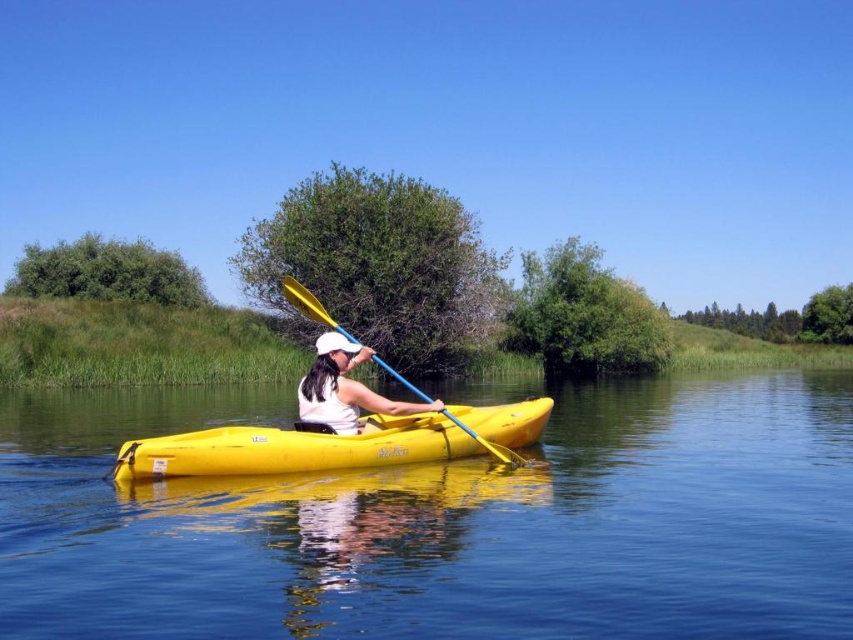
You are a photographer capturing the kayaker from above. You need to ensure both the yellow matte kayak at center and the yellow plastic paddle at center are clearly visible in your shot. Based on their positions, which object should you focus on first to capture both in the frame?

The yellow matte kayak at center is located below the yellow plastic paddle at center, so you should focus on the yellow plastic paddle at center first to ensure both are in the frame.

You are a safety inspector checking the distance between the yellow matte kayak at center and the white matte visor at center. The safety regulation requires at least 2 meters between them. Is the current distance compliant?

The yellow matte kayak at center and the white matte visor at center are 2.18 meters apart, which exceeds the required 2 meters, so the current distance is compliant.

You are a drone operator trying to capture a photo of the yellow matte kayak at center and the yellow plastic paddle at center. The camera has a maximum focus range of 7 meters. Can you capture both objects in focus without moving the drone?

The yellow matte kayak at center and yellow plastic paddle at center are 7.15 meters apart from each other. Since the camera can only focus within 7 meters, the distance between them exceeds the focus range. Therefore, you cannot capture both objects in focus without moving the drone.